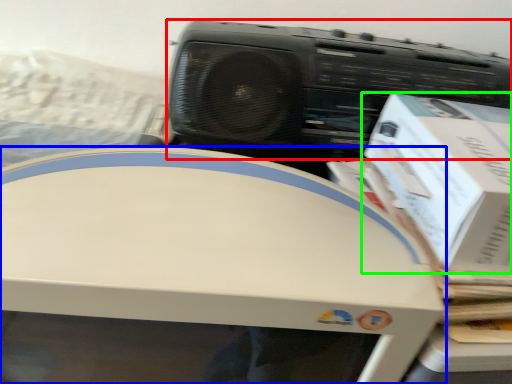
Question: Which is nearer to the cassette (highlighted by a red box)? home appliance (highlighted by a blue box) or box (highlighted by a green box).

Choices:
 (A) home appliance
 (B) box

Answer: (B)